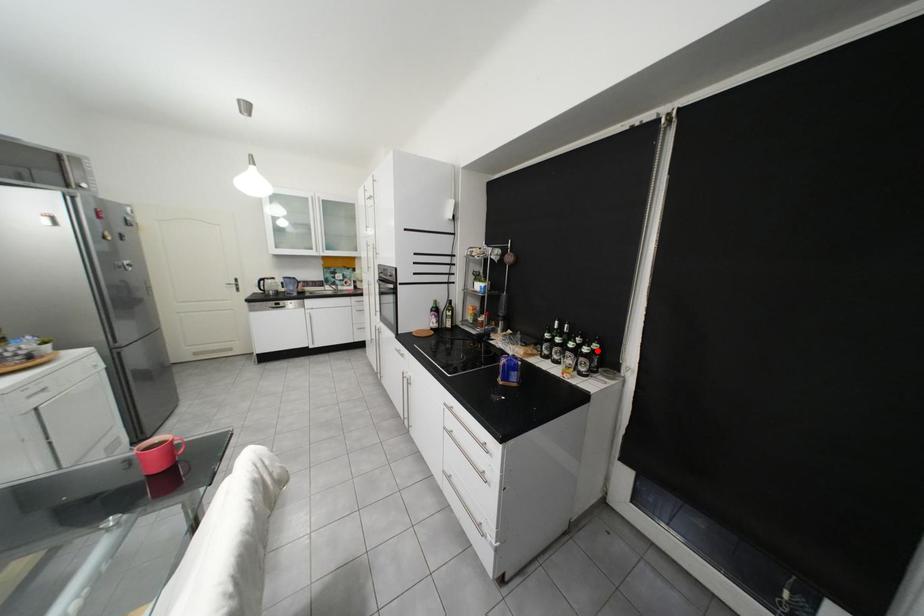
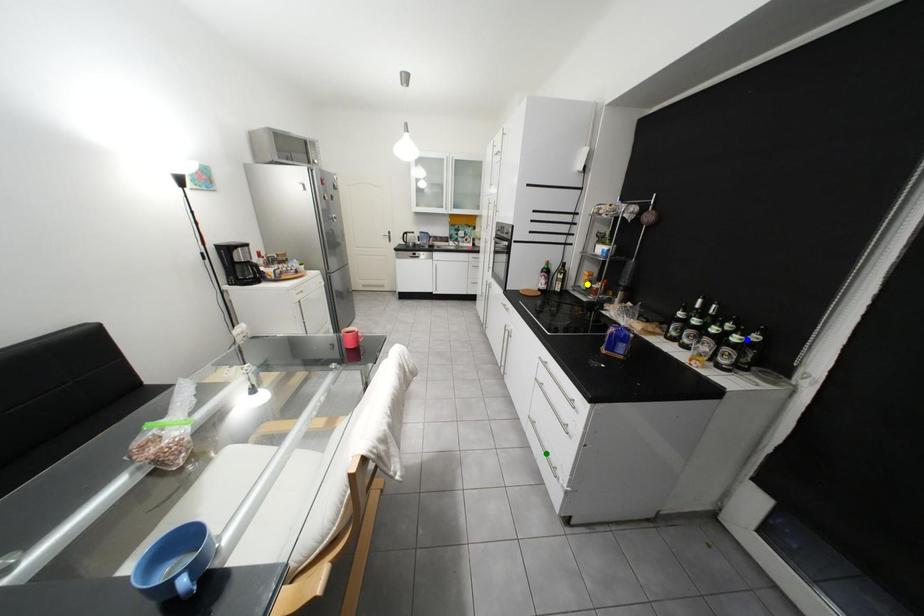
Question: I am providing you with two images of the same scene from different viewpoints. A red point is marked on the first image. You are given multiple points on the second image. Can you choose the point in image 2 that corresponds to the point in image 1?

Choices:
 (A) yellow point
 (B) blue point
 (C) green point

Answer: (B)